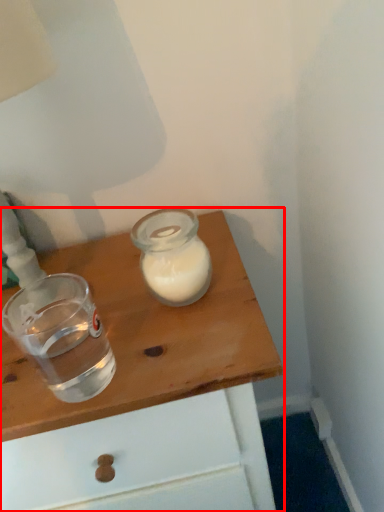
Question: From the image's perspective, what is the correct spatial relationship of table (annotated by the red box) in relation to shot glass?

Choices:
 (A) below
 (B) above

Answer: (A)